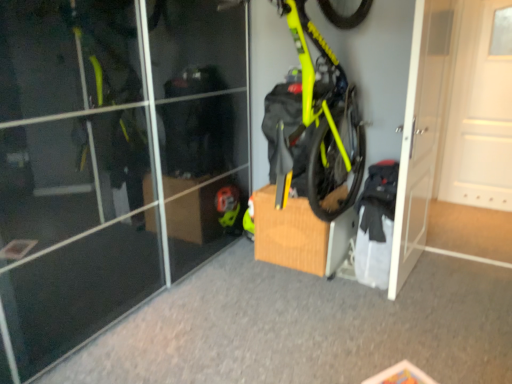
Question: Can you confirm if white glossy door at center right, marked as the second door in a right-to-left arrangement, is smaller than neon yellow matte bicycle at center?

Choices:
 (A) no
 (B) yes

Answer: (B)

Question: Does white glossy door at center right, positioned as the first door in left-to-right order, have a lesser width compared to neon yellow matte bicycle at center?

Choices:
 (A) yes
 (B) no

Answer: (A)

Question: Is white glossy door at center right, positioned as the first door in left-to-right order, oriented away from neon yellow matte bicycle at center?

Choices:
 (A) no
 (B) yes

Answer: (B)

Question: Is white glossy door at center right, positioned as the first door in left-to-right order, completely or partially outside of neon yellow matte bicycle at center?

Choices:
 (A) yes
 (B) no

Answer: (A)

Question: Is the depth of white glossy door at center right, positioned as the first door in left-to-right order, less than that of neon yellow matte bicycle at center?

Choices:
 (A) no
 (B) yes

Answer: (A)

Question: Considering the positions of brown cardboard box at center and neon yellow matte bicycle at center in the image, is brown cardboard box at center bigger or smaller than neon yellow matte bicycle at center?

Choices:
 (A) small
 (B) big

Answer: (A)

Question: Is brown cardboard box at center taller or shorter than neon yellow matte bicycle at center?

Choices:
 (A) short
 (B) tall

Answer: (A)

Question: Is point (259, 256) closer or farther from the camera than point (332, 120)?

Choices:
 (A) closer
 (B) farther

Answer: (B)

Question: Relative to neon yellow matte bicycle at center, is brown cardboard box at center in front or behind?

Choices:
 (A) front
 (B) behind

Answer: (B)

Question: Is point (411, 198) positioned closer to the camera than point (454, 139)?

Choices:
 (A) farther
 (B) closer

Answer: (B)

Question: In the image, is white glossy door at center right, positioned as the first door in left-to-right order, on the left side or the right side of white matte door at right, which ranks as the 2th door in left-to-right order?

Choices:
 (A) right
 (B) left

Answer: (B)

Question: Is white glossy door at center right, marked as the second door in a right-to-left arrangement, taller or shorter than white matte door at right, which appears as the first door when viewed from the right?

Choices:
 (A) tall
 (B) short

Answer: (A)

Question: Based on their sizes in the image, would you say white glossy door at center right, positioned as the first door in left-to-right order, is bigger or smaller than white matte door at right, which ranks as the 2th door in left-to-right order?

Choices:
 (A) big
 (B) small

Answer: (A)

Question: Is point (472, 48) positioned closer to the camera than point (269, 218)?

Choices:
 (A) farther
 (B) closer

Answer: (A)

Question: Considering the positions of white matte door at right, which ranks as the 2th door in left-to-right order, and brown cardboard box at center in the image, is white matte door at right, which ranks as the 2th door in left-to-right order, taller or shorter than brown cardboard box at center?

Choices:
 (A) tall
 (B) short

Answer: (A)